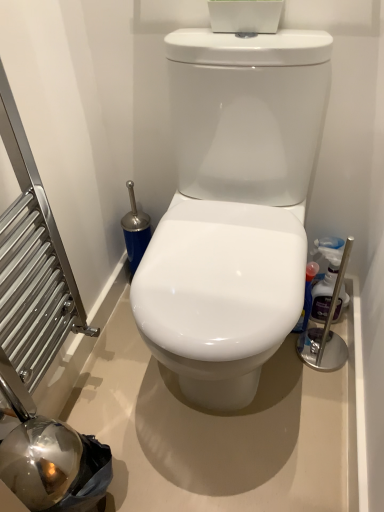
Question: Is glossy plastic spray bottle at right, the first cleaning product positioned from the left, to the right of translucent plastic bottle at right, the 1th cleaning product viewed from the right, from the viewer's perspective?

Choices:
 (A) yes
 (B) no

Answer: (B)

Question: Can you confirm if glossy plastic spray bottle at right, the first cleaning product positioned from the left, is shorter than translucent plastic bottle at right, the 1th cleaning product viewed from the right?

Choices:
 (A) no
 (B) yes

Answer: (B)

Question: Considering the relative positions of glossy plastic spray bottle at right, the first cleaning product positioned from the left, and translucent plastic bottle at right, the 1th cleaning product viewed from the right, in the image provided, is glossy plastic spray bottle at right, the first cleaning product positioned from the left, to the left of translucent plastic bottle at right, the 1th cleaning product viewed from the right, from the viewer's perspective?

Choices:
 (A) yes
 (B) no

Answer: (A)

Question: Is glossy plastic spray bottle at right, which appears as the second cleaning product when viewed from the right, oriented away from translucent plastic bottle at right, the 2th cleaning product when ordered from left to right?

Choices:
 (A) no
 (B) yes

Answer: (A)

Question: From a real-world perspective, is glossy plastic spray bottle at right, the first cleaning product positioned from the left, below translucent plastic bottle at right, the 2th cleaning product when ordered from left to right?

Choices:
 (A) yes
 (B) no

Answer: (A)

Question: From a real-world perspective, is translucent plastic bottle at right, the 1th cleaning product viewed from the right, above or below glossy plastic spray bottle at right, the first cleaning product positioned from the left?

Choices:
 (A) above
 (B) below

Answer: (A)

Question: Based on their sizes in the image, would you say translucent plastic bottle at right, the 2th cleaning product when ordered from left to right, is bigger or smaller than glossy plastic spray bottle at right, which appears as the second cleaning product when viewed from the right?

Choices:
 (A) small
 (B) big

Answer: (A)

Question: Considering the relative positions of translucent plastic bottle at right, the 1th cleaning product viewed from the right, and glossy plastic spray bottle at right, which appears as the second cleaning product when viewed from the right, in the image provided, is translucent plastic bottle at right, the 1th cleaning product viewed from the right, to the left or to the right of glossy plastic spray bottle at right, which appears as the second cleaning product when viewed from the right,?

Choices:
 (A) right
 (B) left

Answer: (A)

Question: In the image, is translucent plastic bottle at right, the 1th cleaning product viewed from the right, positioned in front of or behind glossy plastic spray bottle at right, which appears as the second cleaning product when viewed from the right?

Choices:
 (A) front
 (B) behind

Answer: (A)

Question: Is point coord(248,168) positioned closer to the camera than point coord(304,312)?

Choices:
 (A) closer
 (B) farther

Answer: (A)

Question: From a real-world perspective, is white glossy toilet at center physically located above or below glossy plastic spray bottle at right, the first cleaning product positioned from the left?

Choices:
 (A) above
 (B) below

Answer: (A)

Question: From their relative heights in the image, would you say white glossy toilet at center is taller or shorter than glossy plastic spray bottle at right, which appears as the second cleaning product when viewed from the right?

Choices:
 (A) short
 (B) tall

Answer: (B)

Question: Relative to glossy plastic spray bottle at right, the first cleaning product positioned from the left, is white glossy toilet at center in front or behind?

Choices:
 (A) behind
 (B) front

Answer: (B)

Question: Is white glossy toilet at center wider or thinner than translucent plastic bottle at right, the 2th cleaning product when ordered from left to right?

Choices:
 (A) wide
 (B) thin

Answer: (A)

Question: From the image's perspective, relative to translucent plastic bottle at right, the 1th cleaning product viewed from the right, is white glossy toilet at center above or below?

Choices:
 (A) above
 (B) below

Answer: (A)